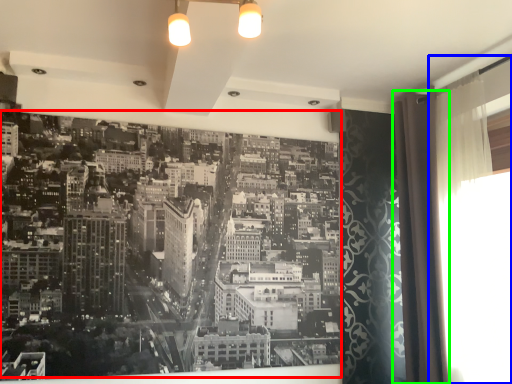
Question: Estimate the real-world distances between objects in this image. Which object is farther from hotel (highlighted by a red box), window screen (highlighted by a blue box) or shower curtain (highlighted by a green box)?

Choices:
 (A) window screen
 (B) shower curtain

Answer: (A)